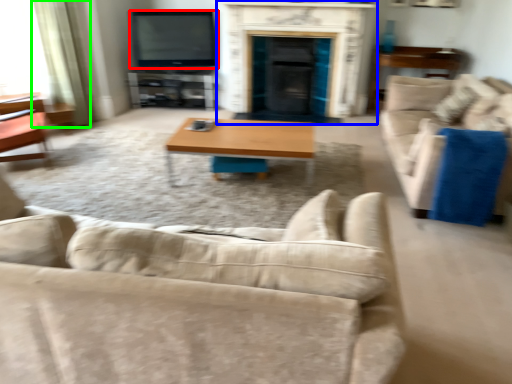
Question: Estimate the real-world distances between objects in this image. Which object is farther from television (highlighted by a red box), fireplace (highlighted by a blue box) or curtain (highlighted by a green box)?

Choices:
 (A) fireplace
 (B) curtain

Answer: (B)